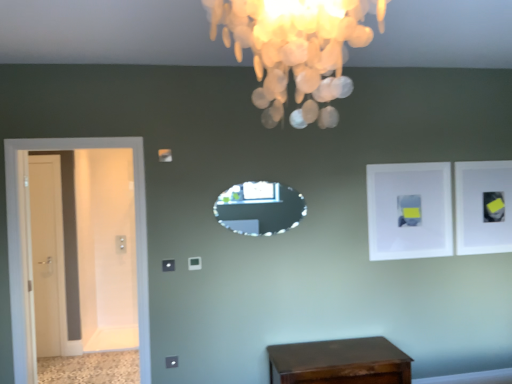
Question: Is white matte picture frame at upper right, arranged as the 2th picture frame when viewed from the back, smaller than white matte picture frame at upper right, placed as the second picture frame when sorted from left to right?

Choices:
 (A) yes
 (B) no

Answer: (A)

Question: Is white matte picture frame at upper right, which appears as the first picture frame when viewed from the left, to the right of white matte picture frame at upper right, which is the 1th picture frame in right-to-left order, from the viewer's perspective?

Choices:
 (A) no
 (B) yes

Answer: (A)

Question: Is white matte picture frame at upper right, placed as the 2th picture frame when sorted from right to left, facing towards white matte picture frame at upper right, placed as the second picture frame when sorted from left to right?

Choices:
 (A) no
 (B) yes

Answer: (A)

Question: Is white matte picture frame at upper right, which appears as the first picture frame when viewed from the left, shorter than white matte picture frame at upper right, placed as the second picture frame when sorted from left to right?

Choices:
 (A) no
 (B) yes

Answer: (B)

Question: Does white matte picture frame at upper right, which appears as the first picture frame when viewed from the left, come in front of white matte picture frame at upper right, placed as the second picture frame when sorted from left to right?

Choices:
 (A) no
 (B) yes

Answer: (B)

Question: From a real-world perspective, is white matte picture frame at upper right, which is counted as the 1th picture frame, starting from the front, physically above white matte picture frame at upper right, which is the 1th picture frame in right-to-left order?

Choices:
 (A) no
 (B) yes

Answer: (A)

Question: Is white matte picture frame at upper right, which is the first picture frame from back to front, taller than ivory shell chandelier at upper center?

Choices:
 (A) yes
 (B) no

Answer: (A)

Question: Is white matte picture frame at upper right, which is the 1th picture frame in right-to-left order, not within ivory shell chandelier at upper center?

Choices:
 (A) no
 (B) yes

Answer: (B)

Question: Does white matte picture frame at upper right, placed as the second picture frame when sorted from left to right, have a lesser width compared to ivory shell chandelier at upper center?

Choices:
 (A) yes
 (B) no

Answer: (A)

Question: From a real-world perspective, is white matte picture frame at upper right, which is the 1th picture frame in right-to-left order, located higher than ivory shell chandelier at upper center?

Choices:
 (A) yes
 (B) no

Answer: (B)

Question: Can you confirm if white matte picture frame at upper right, placed as the second picture frame when sorted from left to right, is bigger than ivory shell chandelier at upper center?

Choices:
 (A) no
 (B) yes

Answer: (A)

Question: Is white matte picture frame at upper right, which is the first picture frame from back to front, to the right of ivory shell chandelier at upper center from the viewer's perspective?

Choices:
 (A) yes
 (B) no

Answer: (A)

Question: Can you confirm if white glossy door at left, acting as the first door starting from the back, is taller than ivory shell chandelier at upper center?

Choices:
 (A) yes
 (B) no

Answer: (A)